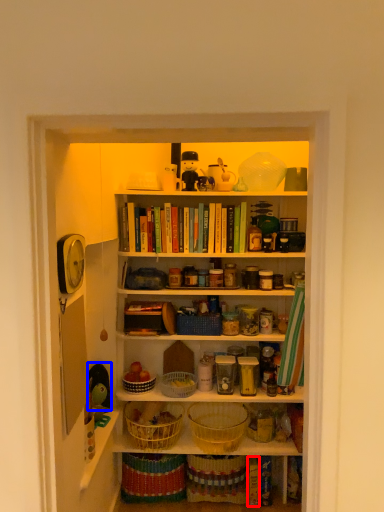
Question: Which point is further to the camera, book (highlighted by a red box) or toy (highlighted by a blue box)?

Choices:
 (A) book
 (B) toy

Answer: (A)